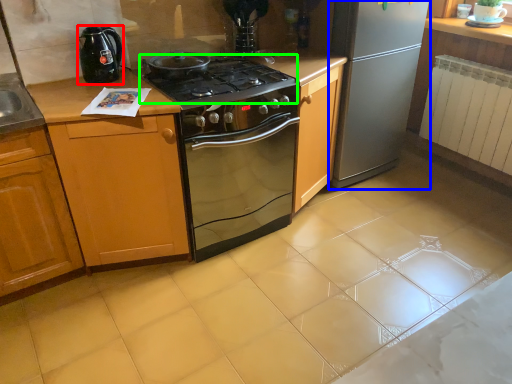
Question: Which object is positioned closest to kitchen appliance (highlighted by a red box)? Select from refrigerator (highlighted by a blue box) and gas stove (highlighted by a green box).

Choices:
 (A) refrigerator
 (B) gas stove

Answer: (B)